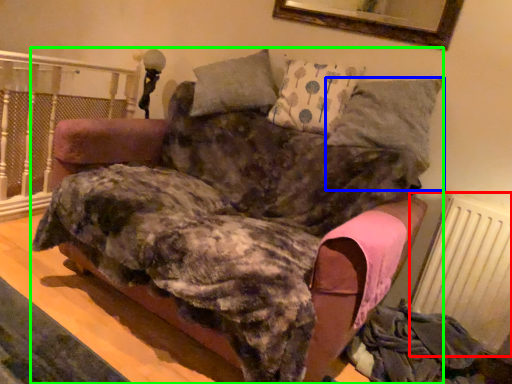
Question: Which object is the closest to the radiator (highlighted by a red box)? Choose among these: pillow (highlighted by a blue box) or furniture (highlighted by a green box).

Choices:
 (A) pillow
 (B) furniture

Answer: (A)